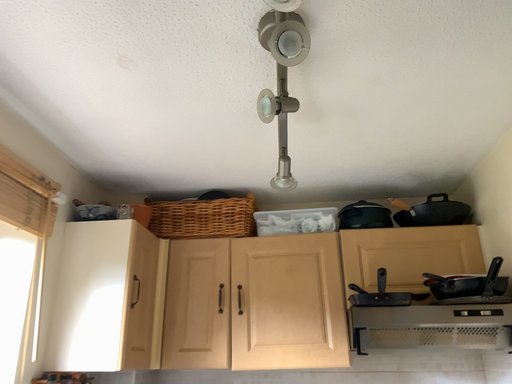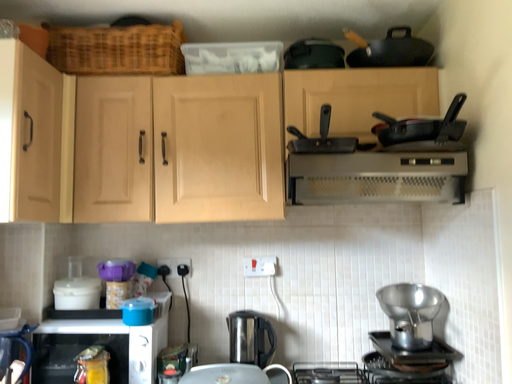
Question: How did the camera likely rotate when shooting the video?

Choices:
 (A) rotated upward
 (B) rotated downward

Answer: (B)